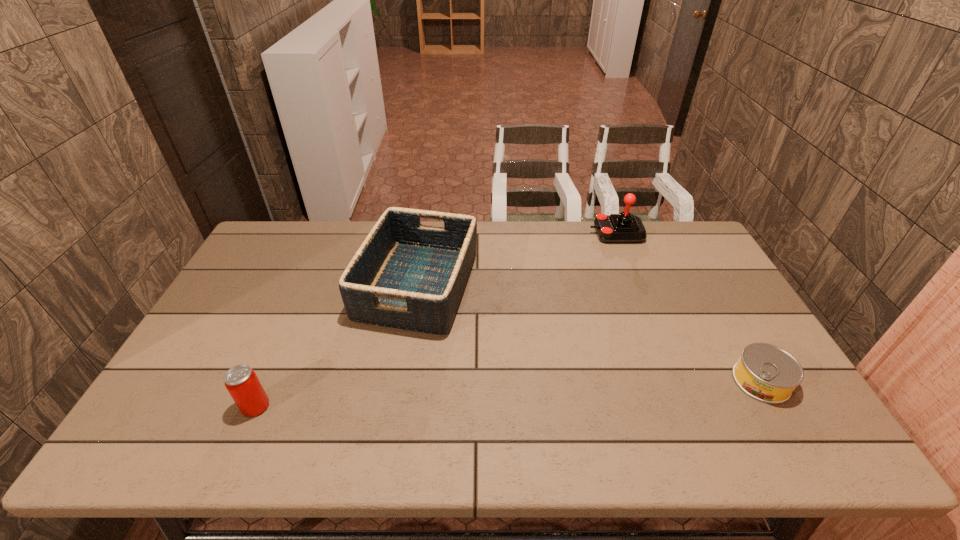
Identify the location of vacant region at the far right corner. The width and height of the screenshot is (960, 540). (709, 254).

The height and width of the screenshot is (540, 960). I want to click on free point between the shortest object and the leftmost object, so click(509, 394).

The image size is (960, 540). Find the location of `free space between the second object from right to left and the second object from left to right`. free space between the second object from right to left and the second object from left to right is located at coordinates (516, 259).

Where is `blank region between the rightmost object and the basket`? The width and height of the screenshot is (960, 540). blank region between the rightmost object and the basket is located at coordinates (589, 333).

Where is `free space between the second shortest object and the basket`? free space between the second shortest object and the basket is located at coordinates (337, 346).

Locate an element on the screen. vacant point located between the shortest object and the basket is located at coordinates (589, 333).

Identify the location of vacant area that lies between the third object from left to right and the second object from left to right. This screenshot has height=540, width=960. (516, 259).

I want to click on empty space between the left can and the right can, so click(x=509, y=394).

Locate an element on the screen. Image resolution: width=960 pixels, height=540 pixels. empty location between the basket and the taller can is located at coordinates (337, 346).

You are a GUI agent. You are given a task and a screenshot of the screen. Output one action in this format:
    pyautogui.click(x=<x>, y=<y>)
    Task: Click on the free space between the shorter can and the basket
    The width and height of the screenshot is (960, 540).
    Given the screenshot: What is the action you would take?
    pyautogui.click(x=589, y=333)